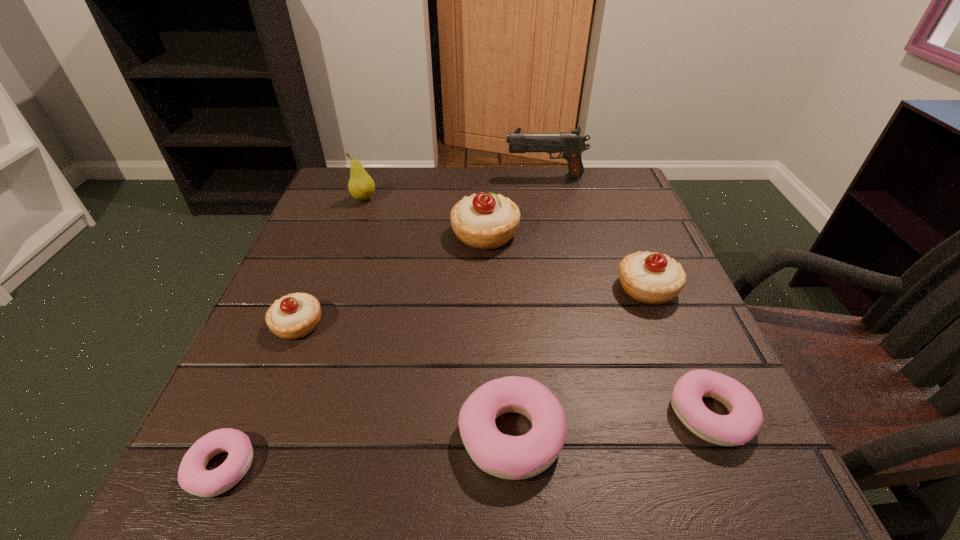
The width and height of the screenshot is (960, 540). I want to click on free space located on the back of the second smallest beige pastry, so point(615,211).

Locate an element on the screen. vacant space located 0.250m on the front of the smallest beige pastry is located at coordinates (228, 497).

This screenshot has width=960, height=540. I want to click on vacant space located on the left of the fourth tallest pastry, so click(339, 436).

Find the location of a particular element. vacant space positioned on the left of the second smallest pink pastry is located at coordinates tap(535, 415).

The height and width of the screenshot is (540, 960). Identify the location of free region located on the back of the smallest pink pastry. click(249, 406).

Locate an element on the screen. gun at the far edge is located at coordinates (571, 144).

I want to click on pear that is at the far edge, so click(x=361, y=186).

The width and height of the screenshot is (960, 540). What are the coordinates of `pastry located in the far edge section of the desktop` in the screenshot? It's located at (485, 221).

You are a GUI agent. You are given a task and a screenshot of the screen. Output one action in this format:
    pyautogui.click(x=<x>, y=<y>)
    Task: Click on the pear that is at the left edge
    This screenshot has width=960, height=540.
    Given the screenshot: What is the action you would take?
    [361, 186]

The width and height of the screenshot is (960, 540). I want to click on gun present at the right edge, so click(x=571, y=144).